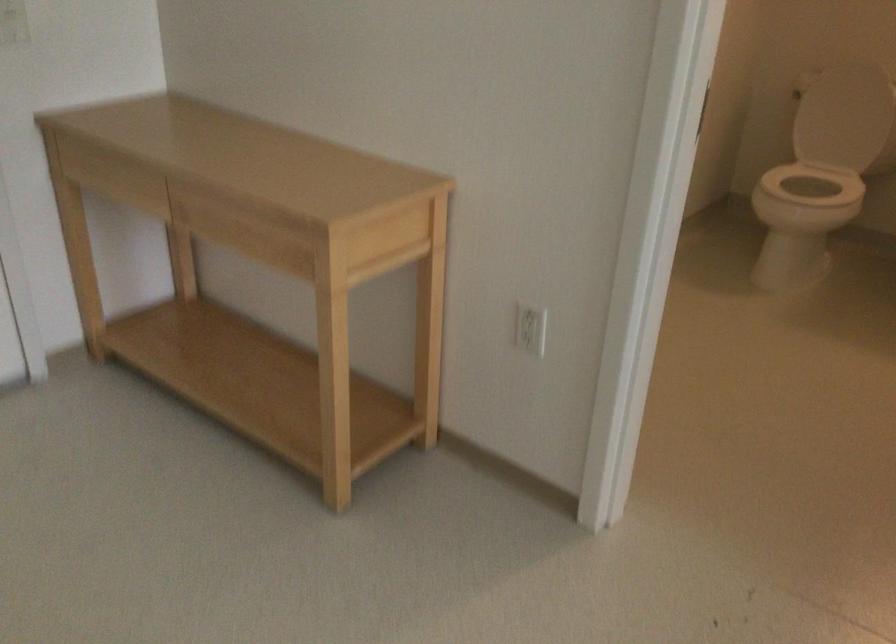
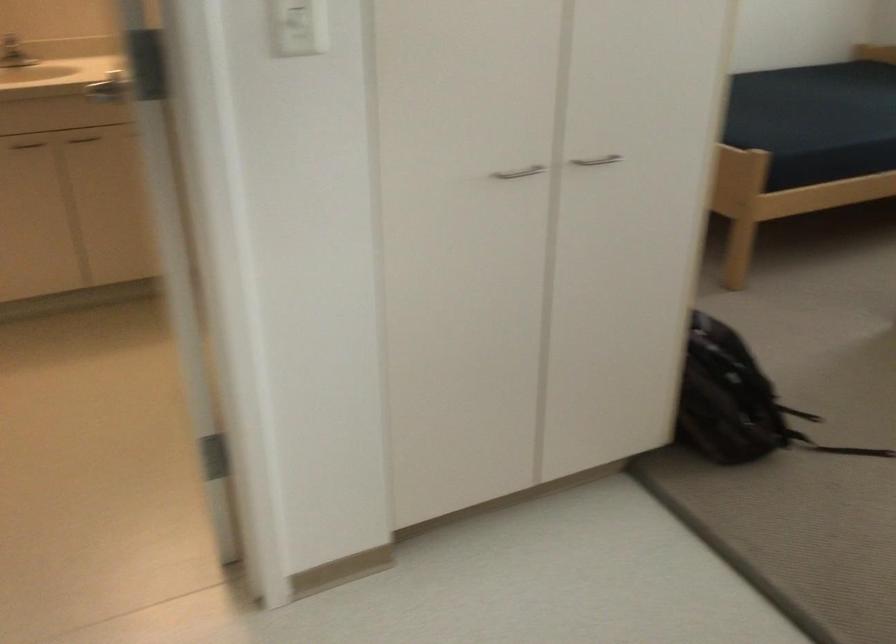
Question: Based on the continuous images, in which direction is the camera rotating? Reply with the corresponding letter.

Choices:
 (A) Left
 (B) Right
 (C) Up
 (D) Down

Answer: (B)